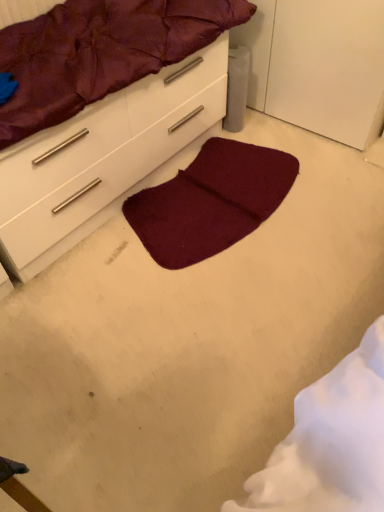
The width and height of the screenshot is (384, 512). Describe the element at coordinates (100, 53) in the screenshot. I see `burgundy fabric mattress at upper center` at that location.

Find the location of a particular element. The image size is (384, 512). burgundy fabric mattress at upper center is located at coordinates (100, 53).

Identify the location of matte white chest of drawers at center. (102, 157).

From the image's perspective, is matte white chest of drawers at center above or below burgundy fabric mattress at upper center?

Based on their image positions, matte white chest of drawers at center is located beneath burgundy fabric mattress at upper center.

Is matte white chest of drawers at center directly adjacent to burgundy fabric mattress at upper center?

matte white chest of drawers at center is not next to burgundy fabric mattress at upper center, and they're not touching.

Based on the photo, from a real-world perspective, which is physically below, matte white chest of drawers at center or burgundy fabric mattress at upper center?

matte white chest of drawers at center is physically lower.

How many degrees apart are the facing directions of matte white chest of drawers at center and burgundy fabric mattress at upper center?

0.833 degrees.

Considering the positions of objects burgundy plush mat at center and burgundy fabric mattress at upper center in the image provided, who is more to the right, burgundy plush mat at center or burgundy fabric mattress at upper center?

burgundy plush mat at center is more to the right.

Would you say burgundy plush mat at center is inside or outside burgundy fabric mattress at upper center?

burgundy plush mat at center cannot be found inside burgundy fabric mattress at upper center.

Is burgundy plush mat at center positioned with its back to burgundy fabric mattress at upper center?

No, burgundy plush mat at center is not facing the opposite direction of burgundy fabric mattress at upper center.

Does point (164, 250) come farther from viewer compared to point (64, 118)?

Yes, it is.

Would you say burgundy fabric mattress at upper center is outside burgundy plush mat at center?

Indeed, burgundy fabric mattress at upper center is completely outside burgundy plush mat at center.

Where is `mat that is below the burgundy fabric mattress at upper center (from the image's perspective)`? The width and height of the screenshot is (384, 512). mat that is below the burgundy fabric mattress at upper center (from the image's perspective) is located at coordinates (210, 202).

Which is behind, point (116, 90) or point (219, 210)?

The point (219, 210) is behind.

Considering the sizes of burgundy fabric mattress at upper center and burgundy plush mat at center in the image, is burgundy fabric mattress at upper center wider or thinner than burgundy plush mat at center?

In the image, burgundy fabric mattress at upper center appears to be more narrow than burgundy plush mat at center.

Which object is thinner, matte white chest of drawers at center or burgundy plush mat at center?

With smaller width is burgundy plush mat at center.

Is matte white chest of drawers at center shorter than burgundy plush mat at center?

Incorrect, the height of matte white chest of drawers at center does not fall short of that of burgundy plush mat at center.

In the scene shown: From the image's perspective, would you say matte white chest of drawers at center is positioned over burgundy plush mat at center?

Yes.

Does point (51, 175) appear closer or farther from the camera than point (256, 197)?

Point (51, 175) is closer to the camera than point (256, 197).

Is the position of burgundy plush mat at center less distant than that of matte white chest of drawers at center?

No, burgundy plush mat at center is further to the viewer.

Is burgundy plush mat at center oriented away from matte white chest of drawers at center?

Absolutely, burgundy plush mat at center is directed away from matte white chest of drawers at center.

Can you tell me how much burgundy plush mat at center and matte white chest of drawers at center differ in facing direction?

burgundy plush mat at center and matte white chest of drawers at center are facing 0.214 degrees away from each other.

Considering the sizes of burgundy plush mat at center and matte white chest of drawers at center in the image, is burgundy plush mat at center bigger or smaller than matte white chest of drawers at center?

In the image, burgundy plush mat at center appears to be smaller than matte white chest of drawers at center.

Which is in front, burgundy fabric mattress at upper center or matte white chest of drawers at center?

burgundy fabric mattress at upper center is more forward.

In the image, there is a matte white chest of drawers at center. Find the location of `mattress above it (from the image's perspective)`. mattress above it (from the image's perspective) is located at coordinates (100, 53).

What's the angular difference between burgundy fabric mattress at upper center and matte white chest of drawers at center's facing directions?

0.833 degrees separate the facing orientations of burgundy fabric mattress at upper center and matte white chest of drawers at center.

Is point (63, 44) positioned in front of point (70, 153)?

No, it is behind (70, 153).

You are a GUI agent. You are given a task and a screenshot of the screen. Output one action in this format:
    pyautogui.click(x=<x>, y=<y>)
    Task: Click on the mattress above the matte white chest of drawers at center (from the image's perspective)
    The width and height of the screenshot is (384, 512).
    Given the screenshot: What is the action you would take?
    point(100,53)

This screenshot has width=384, height=512. Identify the location of mat that is behind the burgundy fabric mattress at upper center. [x=210, y=202].

Considering their positions, is burgundy fabric mattress at upper center positioned closer to matte white chest of drawers at center than burgundy plush mat at center?

burgundy fabric mattress at upper center.

Which object lies further to the anchor point burgundy plush mat at center, burgundy fabric mattress at upper center or matte white chest of drawers at center?

The object further to burgundy plush mat at center is burgundy fabric mattress at upper center.

Estimate the real-world distances between objects in this image. Which object is further from burgundy plush mat at center, matte white chest of drawers at center or burgundy fabric mattress at upper center?

burgundy fabric mattress at upper center is positioned further to the anchor burgundy plush mat at center.

Looking at the image, which one is located closer to burgundy fabric mattress at upper center, matte white chest of drawers at center or burgundy plush mat at center?

Based on the image, matte white chest of drawers at center appears to be nearer to burgundy fabric mattress at upper center.

When comparing their distances from matte white chest of drawers at center, does burgundy plush mat at center or burgundy fabric mattress at upper center seem further?

Among the two, burgundy plush mat at center is located further to matte white chest of drawers at center.

Which object lies nearer to the anchor point burgundy fabric mattress at upper center, burgundy plush mat at center or matte white chest of drawers at center?

matte white chest of drawers at center.

Locate an element on the screen. chest of drawers between burgundy fabric mattress at upper center and burgundy plush mat at center from front to back is located at coordinates (x=102, y=157).